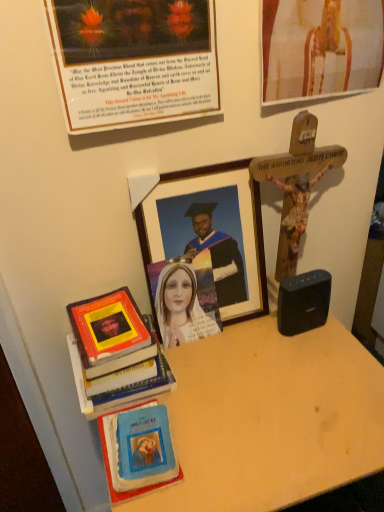
What are the coordinates of `free space in front of black plastic speaker at right` in the screenshot? It's located at (313, 378).